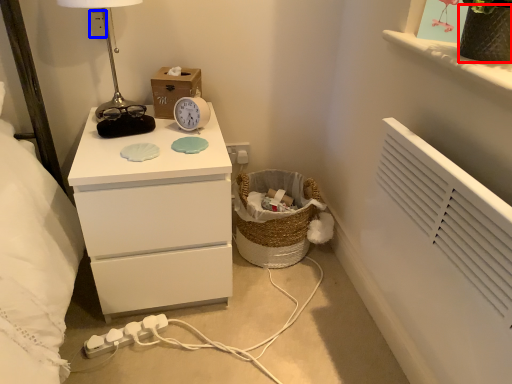
Question: Which of the following is the closest to the observer, vase (highlighted by a red box) or electric outlet (highlighted by a blue box)?

Choices:
 (A) vase
 (B) electric outlet

Answer: (A)